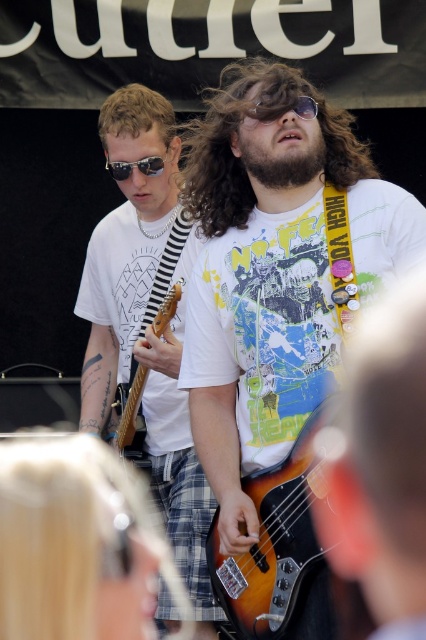
Does white printed t-shirt at left appear on the left side of sunglasses at center?

In fact, white printed t-shirt at left is to the right of sunglasses at center.

Does white printed t-shirt at left lie behind sunglasses at center?

No, white printed t-shirt at left is closer to the viewer.

You are a GUI agent. You are given a task and a screenshot of the screen. Output one action in this format:
    pyautogui.click(x=<x>, y=<y>)
    Task: Click on the white printed t-shirt at left
    
    Given the screenshot: What is the action you would take?
    tap(120, 276)

Which is behind, point (195, 140) or point (302, 172)?

The point (195, 140) is more distant.

What do you see at coordinates (239, 160) in the screenshot? The image size is (426, 640). I see `curly brown hair at center` at bounding box center [239, 160].

The image size is (426, 640). In order to click on curly brown hair at center in this screenshot , I will do `click(239, 160)`.

Which is in front, point (304, 484) or point (307, 102)?

Positioned in front is point (304, 484).

From the picture: Which is above, sunburst wood bass guitar at center or transparent plastic goggles at center?

transparent plastic goggles at center

Find the location of a particular element. This screenshot has width=426, height=640. sunburst wood bass guitar at center is located at coordinates (278, 552).

Image resolution: width=426 pixels, height=640 pixels. In order to click on sunburst wood bass guitar at center in this screenshot , I will do `click(278, 552)`.